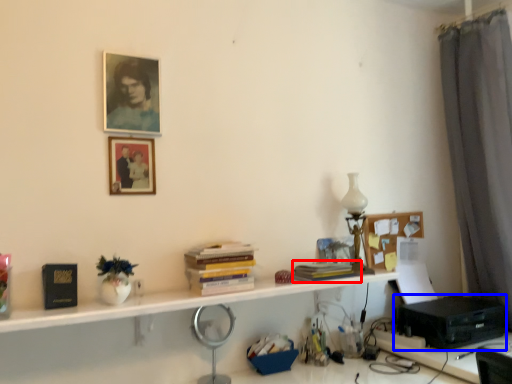
Question: Which of the following is the farthest to the observer, book (highlighted by a red box) or printer (highlighted by a blue box)?

Choices:
 (A) book
 (B) printer

Answer: (B)